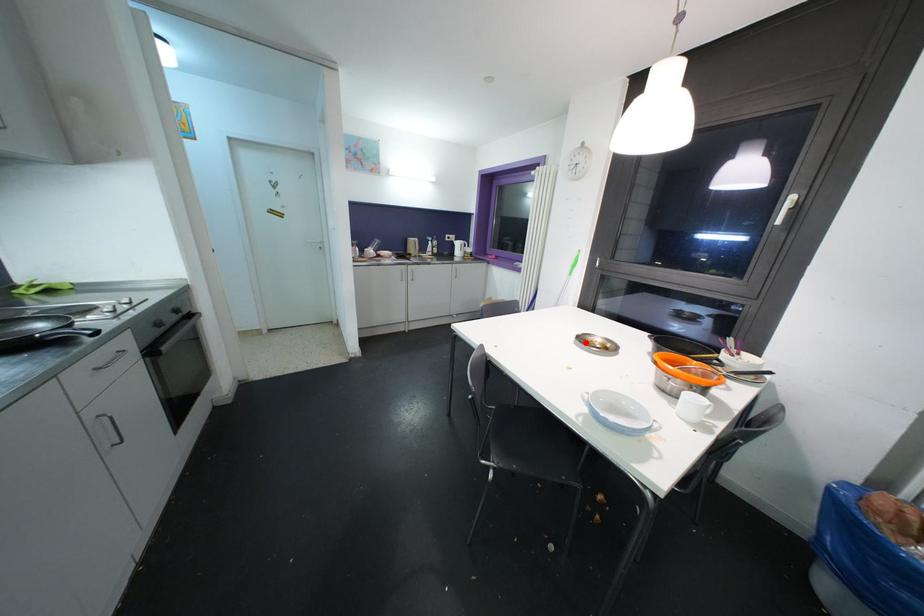
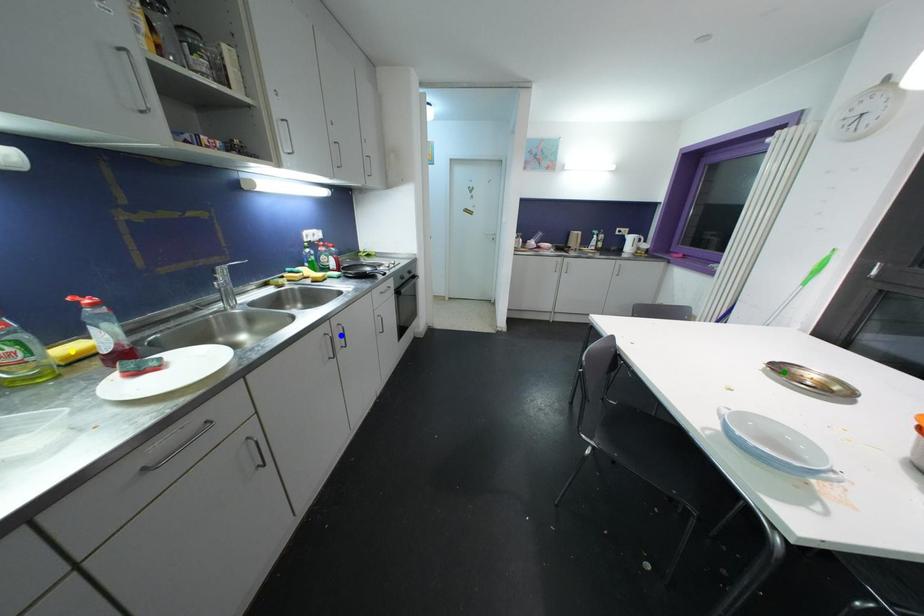
Question: I am providing you with two images of the same scene from different viewpoints. A red point is marked on the first image. You are given multiple points on the second image. Which spot in image 2 lines up with the point in image 1?

Choices:
 (A) yellow point
 (B) blue point
 (C) green point

Answer: (C)